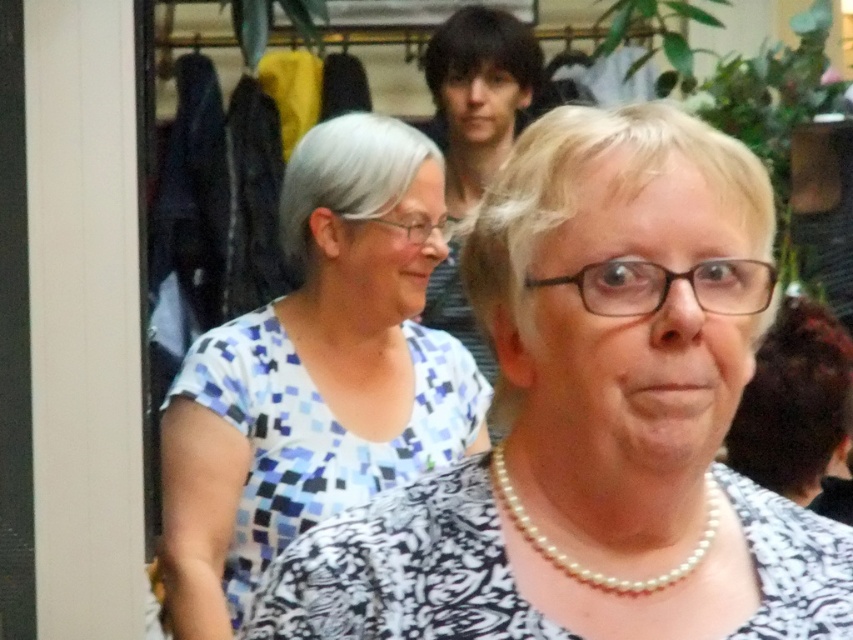
You are a photographer at the event and want to ensure both the blue mosaic shirt at center and the pearl necklace at center are clearly visible in your photo. Which object should you focus on to capture more of its details without zooming in further?

The blue mosaic shirt at center has a greater width than the pearl necklace at center, so focusing on the blue mosaic shirt at center would allow you to capture more of its details without needing to zoom in further.

You are at a social event and notice two people wearing the white printed blouse at center and the blue mosaic shirt at center. Which one is positioned more to the left?

The blue mosaic shirt at center is positioned more to the left because the white printed blouse at center is to the right of it.

You are organizing a photo album and need to ensure that the white printed blouse at center and pearl necklace at center are both visible in the photo. Based on their sizes, which one is more likely to be clearly visible in the photo?

The white printed blouse at center is larger in size than the pearl necklace at center, so it is more likely to be clearly visible in the photo.